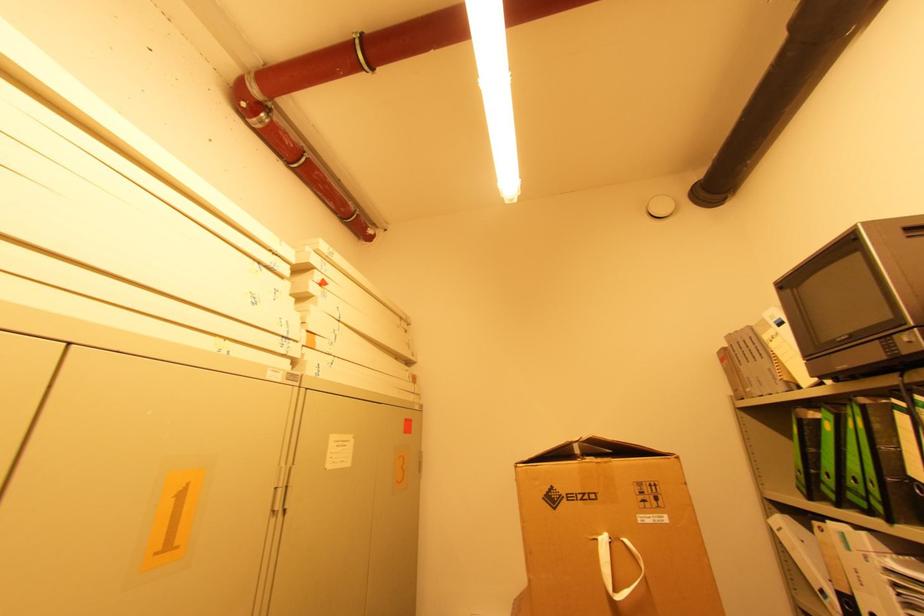
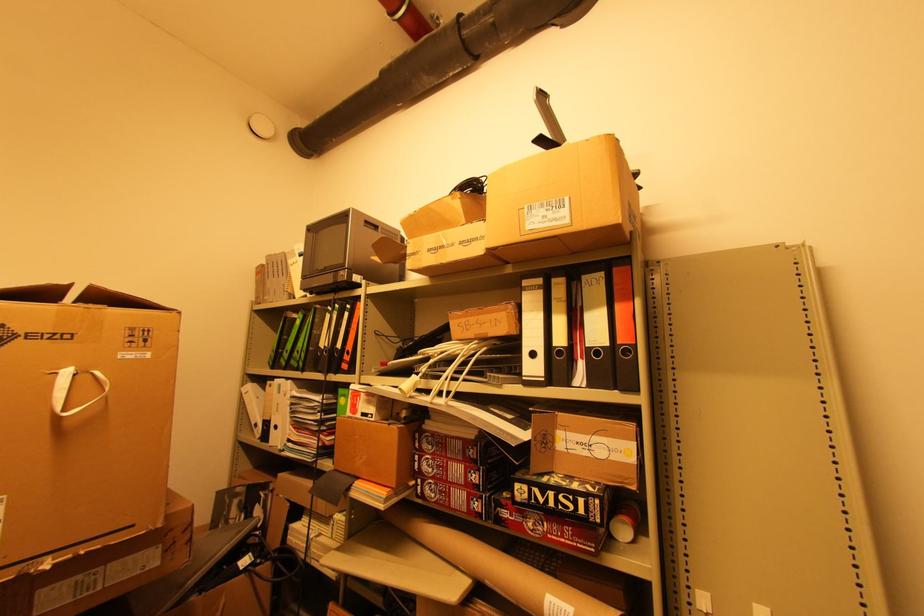
Where in the second image is the point corresponding to point 597,496 from the first image?

(70, 338)